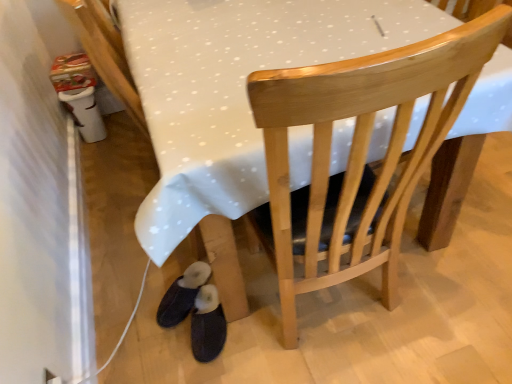
This screenshot has width=512, height=384. I want to click on wooden chair at center, so click(x=357, y=155).

Image resolution: width=512 pixels, height=384 pixels. I want to click on dark blue fabric slippers at lower left, marked as the 2th footwear in a left-to-right arrangement, so click(x=207, y=325).

Identify the location of wooden chair at center. The width and height of the screenshot is (512, 384). pyautogui.click(x=357, y=155).

Are wooden chair at center and dark blue fabric slippers at lower left, marked as the 1th footwear in a right-to-left arrangement, far apart?

They are positioned close to each other.

From a real-world perspective, between wooden chair at center and dark blue fabric slippers at lower left, marked as the 1th footwear in a right-to-left arrangement, who is vertically higher?

wooden chair at center is physically above.

From the image's perspective, which is below, wooden chair at center or dark blue fabric slippers at lower left, marked as the 2th footwear in a left-to-right arrangement?

From the image's view, dark blue fabric slippers at lower left, marked as the 2th footwear in a left-to-right arrangement, is below.

Can you tell me how much wooden chair at center and black suede slippers at lower left, which appears as the 2th footwear when viewed from the right, differ in facing direction?

The angle between the facing direction of wooden chair at center and the facing direction of black suede slippers at lower left, which appears as the 2th footwear when viewed from the right, is 142 degrees.

Which is more to the right, wooden chair at center or black suede slippers at lower left, which appears as the 2th footwear when viewed from the right?

Positioned to the right is wooden chair at center.

Does wooden chair at center have a larger size compared to black suede slippers at lower left, positioned as the first footwear in left-to-right order?

Yes.

Is point (172, 288) positioned before point (319, 70)?

No, (172, 288) is behind (319, 70).

Based on the photo, does black suede slippers at lower left, positioned as the first footwear in left-to-right order, contain wooden chair at center?

No, wooden chair at center is not inside black suede slippers at lower left, positioned as the first footwear in left-to-right order.

At what (x,y) coordinates should I click in order to perform the action: click on chair that appears above the black suede slippers at lower left, which appears as the 2th footwear when viewed from the right (from the image's perspective). Please return your answer as a coordinate pair (x, y). This screenshot has height=384, width=512. Looking at the image, I should click on (357, 155).

From a real-world perspective, which is physically below, black suede slippers at lower left, positioned as the first footwear in left-to-right order, or wooden chair at center?

black suede slippers at lower left, positioned as the first footwear in left-to-right order, from a real-world perspective.

From the picture: Are black suede slippers at lower left, which appears as the 2th footwear when viewed from the right, and dark blue fabric slippers at lower left, marked as the 2th footwear in a left-to-right arrangement, beside each other?

Yes, black suede slippers at lower left, which appears as the 2th footwear when viewed from the right, and dark blue fabric slippers at lower left, marked as the 2th footwear in a left-to-right arrangement, clearly make contact.

Is black suede slippers at lower left, which appears as the 2th footwear when viewed from the right, taller than dark blue fabric slippers at lower left, marked as the 2th footwear in a left-to-right arrangement?

No.

Considering the points (191, 267) and (199, 303), which point is behind, point (191, 267) or point (199, 303)?

The point (191, 267) is more distant.

Looking at this image, from the image's perspective, who appears lower, black suede slippers at lower left, positioned as the first footwear in left-to-right order, or dark blue fabric slippers at lower left, marked as the 1th footwear in a right-to-left arrangement?

dark blue fabric slippers at lower left, marked as the 1th footwear in a right-to-left arrangement, is shown below in the image.

Is dark blue fabric slippers at lower left, marked as the 1th footwear in a right-to-left arrangement, placed right next to black suede slippers at lower left, positioned as the first footwear in left-to-right order?

Indeed, dark blue fabric slippers at lower left, marked as the 1th footwear in a right-to-left arrangement, and black suede slippers at lower left, positioned as the first footwear in left-to-right order, are beside each other and touching.

Is dark blue fabric slippers at lower left, marked as the 1th footwear in a right-to-left arrangement, completely or partially outside of black suede slippers at lower left, which appears as the 2th footwear when viewed from the right?

Yes, dark blue fabric slippers at lower left, marked as the 1th footwear in a right-to-left arrangement, is located beyond the bounds of black suede slippers at lower left, which appears as the 2th footwear when viewed from the right.

Considering the relative sizes of dark blue fabric slippers at lower left, marked as the 1th footwear in a right-to-left arrangement, and black suede slippers at lower left, which appears as the 2th footwear when viewed from the right, in the image provided, is dark blue fabric slippers at lower left, marked as the 1th footwear in a right-to-left arrangement, taller than black suede slippers at lower left, which appears as the 2th footwear when viewed from the right,?

Indeed, dark blue fabric slippers at lower left, marked as the 1th footwear in a right-to-left arrangement, has a greater height compared to black suede slippers at lower left, which appears as the 2th footwear when viewed from the right.

From the image's perspective, is dark blue fabric slippers at lower left, marked as the 1th footwear in a right-to-left arrangement, under black suede slippers at lower left, positioned as the first footwear in left-to-right order?

Indeed, from the image's perspective, dark blue fabric slippers at lower left, marked as the 1th footwear in a right-to-left arrangement, is shown beneath black suede slippers at lower left, positioned as the first footwear in left-to-right order.

Can you confirm if dark blue fabric slippers at lower left, marked as the 1th footwear in a right-to-left arrangement, is taller than wooden chair at center?

Incorrect, the height of dark blue fabric slippers at lower left, marked as the 1th footwear in a right-to-left arrangement, is not larger of that of wooden chair at center.

Considering the relative positions of dark blue fabric slippers at lower left, marked as the 2th footwear in a left-to-right arrangement, and wooden chair at center in the image provided, is dark blue fabric slippers at lower left, marked as the 2th footwear in a left-to-right arrangement, to the left or to the right of wooden chair at center?

In the image, dark blue fabric slippers at lower left, marked as the 2th footwear in a left-to-right arrangement, appears on the left side of wooden chair at center.

Is dark blue fabric slippers at lower left, marked as the 2th footwear in a left-to-right arrangement, positioned in front of wooden chair at center?

No, it is behind wooden chair at center.

Is dark blue fabric slippers at lower left, marked as the 2th footwear in a left-to-right arrangement, directly adjacent to wooden chair at center?

No, dark blue fabric slippers at lower left, marked as the 2th footwear in a left-to-right arrangement, is not touching wooden chair at center.

Find the location of a particular element. The height and width of the screenshot is (384, 512). the 1st footwear to the left of the wooden chair at center, starting your count from the anchor is located at coordinates (207, 325).

In order to click on chair above the black suede slippers at lower left, which appears as the 2th footwear when viewed from the right (from a real-world perspective) in this screenshot , I will do `click(357, 155)`.

Which object lies nearer to the anchor point wooden chair at center, dark blue fabric slippers at lower left, marked as the 2th footwear in a left-to-right arrangement, or black suede slippers at lower left, which appears as the 2th footwear when viewed from the right?

The object closer to wooden chair at center is dark blue fabric slippers at lower left, marked as the 2th footwear in a left-to-right arrangement.

Estimate the real-world distances between objects in this image. Which object is further from black suede slippers at lower left, positioned as the first footwear in left-to-right order, wooden chair at center or dark blue fabric slippers at lower left, marked as the 1th footwear in a right-to-left arrangement?

The object further to black suede slippers at lower left, positioned as the first footwear in left-to-right order, is wooden chair at center.

From the image, which object appears to be nearer to black suede slippers at lower left, positioned as the first footwear in left-to-right order, dark blue fabric slippers at lower left, marked as the 1th footwear in a right-to-left arrangement, or wooden chair at center?

Based on the image, dark blue fabric slippers at lower left, marked as the 1th footwear in a right-to-left arrangement, appears to be nearer to black suede slippers at lower left, positioned as the first footwear in left-to-right order.

Based on their spatial positions, is wooden chair at center or black suede slippers at lower left, which appears as the 2th footwear when viewed from the right, further from dark blue fabric slippers at lower left, marked as the 1th footwear in a right-to-left arrangement?

The object further to dark blue fabric slippers at lower left, marked as the 1th footwear in a right-to-left arrangement, is wooden chair at center.

From the image, which object appears to be nearer to wooden chair at center, black suede slippers at lower left, positioned as the first footwear in left-to-right order, or dark blue fabric slippers at lower left, marked as the 2th footwear in a left-to-right arrangement?

dark blue fabric slippers at lower left, marked as the 2th footwear in a left-to-right arrangement, is closer to wooden chair at center.

From the picture: Looking at the image, which one is located further to dark blue fabric slippers at lower left, marked as the 2th footwear in a left-to-right arrangement, black suede slippers at lower left, which appears as the 2th footwear when viewed from the right, or wooden chair at center?

Among the two, wooden chair at center is located further to dark blue fabric slippers at lower left, marked as the 2th footwear in a left-to-right arrangement.

This screenshot has height=384, width=512. Identify the location of footwear positioned between wooden chair at center and black suede slippers at lower left, which appears as the 2th footwear when viewed from the right, from near to far. (207, 325).